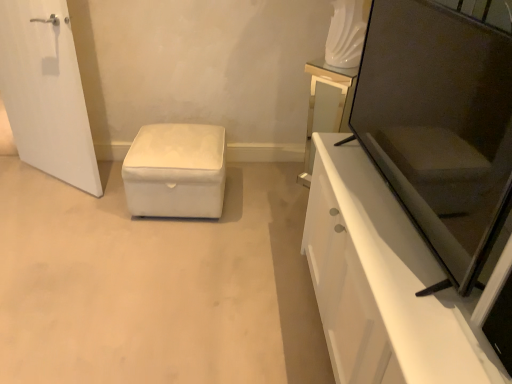
Locate an element on the screen. This screenshot has width=512, height=384. matte glass vanity at upper right is located at coordinates (326, 106).

Does white glossy cabinet at right have a larger size compared to matte black screen door at right?

Yes.

Does point (407, 287) lie behind point (452, 224)?

Yes, it is behind point (452, 224).

Considering the sizes of objects white glossy cabinet at right and matte black screen door at right in the image provided, who is taller, white glossy cabinet at right or matte black screen door at right?

white glossy cabinet at right is taller.

From the image's perspective, does white glossy cabinet at right appear lower than matte black screen door at right?

Yes, from the image's perspective, white glossy cabinet at right is beneath matte black screen door at right.

Consider the image. Considering the sizes of objects white fabric ottoman at center and matte glass vanity at upper right in the image provided, who is thinner, white fabric ottoman at center or matte glass vanity at upper right?

matte glass vanity at upper right.

Considering the sizes of objects white fabric ottoman at center and matte glass vanity at upper right in the image provided, who is shorter, white fabric ottoman at center or matte glass vanity at upper right?

Standing shorter between the two is white fabric ottoman at center.

In the image, is white fabric ottoman at center on the left side or the right side of matte glass vanity at upper right?

white fabric ottoman at center is to the left of matte glass vanity at upper right.

Measure the distance from matte black screen door at right to white fabric ottoman at center.

They are 1.12 meters apart.

Is matte black screen door at right far away from white fabric ottoman at center?

Yes, matte black screen door at right and white fabric ottoman at center are quite far apart.

Do you think matte black screen door at right is within white fabric ottoman at center, or outside of it?

matte black screen door at right is outside white fabric ottoman at center.

From a real-world perspective, who is located higher, matte black screen door at right or white fabric ottoman at center?

matte black screen door at right.

From the image's perspective, is matte glass vanity at upper right located beneath matte black screen door at right?

Incorrect, from the image's perspective, matte glass vanity at upper right is higher than matte black screen door at right.

Is matte glass vanity at upper right beside matte black screen door at right?

They are not placed beside each other.

This screenshot has width=512, height=384. What are the coordinates of `screen door below the matte glass vanity at upper right (from the image's perspective)` in the screenshot? It's located at (441, 122).

Could you tell me if matte black screen door at right is turned towards white glossy cabinet at right?

Yes, matte black screen door at right is facing white glossy cabinet at right.

Between matte black screen door at right and white glossy cabinet at right, which one appears on the right side from the viewer's perspective?

From the viewer's perspective, white glossy cabinet at right appears more on the right side.

In terms of height, does matte black screen door at right look taller or shorter compared to white glossy cabinet at right?

In the image, matte black screen door at right appears to be shorter than white glossy cabinet at right.

Between point (440, 23) and point (366, 289), which one is positioned behind?

Point (366, 289)

Looking at this image, which is more to the left, matte glass vanity at upper right or white glossy cabinet at right?

matte glass vanity at upper right is more to the left.

Is point (326, 122) behind point (402, 317)?

Yes, point (326, 122) is farther from viewer.

From the image's perspective, is matte glass vanity at upper right above white glossy cabinet at right?

Correct, matte glass vanity at upper right appears higher than white glossy cabinet at right in the image.

I want to click on vanity lying above the white glossy cabinet at right (from the image's perspective), so click(x=326, y=106).

How many degrees apart are the facing directions of white glossy cabinet at right and white fabric ottoman at center?

white glossy cabinet at right and white fabric ottoman at center are facing 88.3 degrees away from each other.

You are a GUI agent. You are given a task and a screenshot of the screen. Output one action in this format:
    pyautogui.click(x=<x>, y=<y>)
    Task: Click on the furniture above the white glossy cabinet at right (from the image's perspective)
    The height and width of the screenshot is (384, 512).
    Given the screenshot: What is the action you would take?
    pyautogui.click(x=176, y=171)

Would you consider white glossy cabinet at right to be distant from white fabric ottoman at center?

Actually, white glossy cabinet at right and white fabric ottoman at center are a little close together.

Choose the correct answer: Is white glossy cabinet at right inside white fabric ottoman at center or outside it?

white glossy cabinet at right lies outside white fabric ottoman at center.

Locate an element on the screen. cabinetry in front of the matte black screen door at right is located at coordinates (383, 283).

This screenshot has height=384, width=512. I want to click on furniture that is under the matte glass vanity at upper right (from a real-world perspective), so pyautogui.click(x=176, y=171).

Considering their positions, is matte glass vanity at upper right positioned closer to white fabric ottoman at center than white glossy cabinet at right?

matte glass vanity at upper right.

Estimate the real-world distances between objects in this image. Which object is further from matte glass vanity at upper right, white fabric ottoman at center or matte black screen door at right?

The object further to matte glass vanity at upper right is white fabric ottoman at center.

Considering their positions, is white fabric ottoman at center positioned further to matte black screen door at right than white glossy cabinet at right?

white fabric ottoman at center.

Estimate the real-world distances between objects in this image. Which object is further from white fabric ottoman at center, matte black screen door at right or matte glass vanity at upper right?

matte black screen door at right.

When comparing their distances from white fabric ottoman at center, does white glossy cabinet at right or matte black screen door at right seem closer?

Among the two, white glossy cabinet at right is located nearer to white fabric ottoman at center.

Looking at this image, considering their positions, is matte glass vanity at upper right positioned closer to matte black screen door at right than white glossy cabinet at right?

white glossy cabinet at right.

Based on their spatial positions, is white glossy cabinet at right or matte glass vanity at upper right further from white fabric ottoman at center?

white glossy cabinet at right is further to white fabric ottoman at center.

Based on their spatial positions, is white fabric ottoman at center or matte black screen door at right closer to white glossy cabinet at right?

Based on the image, matte black screen door at right appears to be nearer to white glossy cabinet at right.

Where is `furniture between white glossy cabinet at right and matte glass vanity at upper right along the z-axis`? This screenshot has height=384, width=512. furniture between white glossy cabinet at right and matte glass vanity at upper right along the z-axis is located at coordinates (176, 171).

Find the location of a particular element. The image size is (512, 384). screen door between white glossy cabinet at right and matte glass vanity at upper right along the z-axis is located at coordinates (441, 122).

At what (x,y) coordinates should I click in order to perform the action: click on screen door between white glossy cabinet at right and white fabric ottoman at center along the z-axis. Please return your answer as a coordinate pair (x, y). This screenshot has width=512, height=384. Looking at the image, I should click on (441, 122).

Find the location of `furniture between matte black screen door at right and matte glass vanity at upper right from front to back`. furniture between matte black screen door at right and matte glass vanity at upper right from front to back is located at coordinates (176, 171).